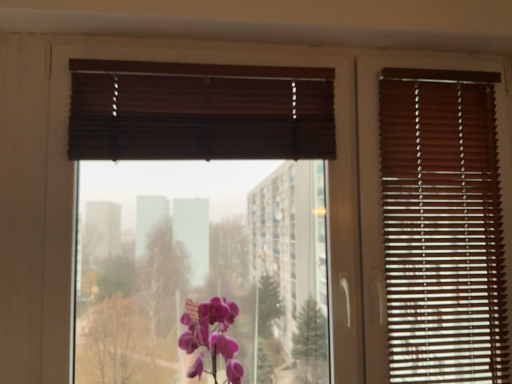
Question: Based on their positions, is brown wood blinds at center located to the left or right of purple glossy orchid at center?

Choices:
 (A) right
 (B) left

Answer: (B)

Question: In the image, is brown wood blinds at center positioned in front of or behind purple glossy orchid at center?

Choices:
 (A) behind
 (B) front

Answer: (A)

Question: Is point (209, 137) positioned closer to the camera than point (226, 339)?

Choices:
 (A) farther
 (B) closer

Answer: (A)

Question: Based on their positions, is purple glossy orchid at center located to the left or right of brown wood blinds at center?

Choices:
 (A) right
 (B) left

Answer: (A)

Question: Does point (186, 337) appear closer or farther from the camera than point (295, 112)?

Choices:
 (A) farther
 (B) closer

Answer: (B)

Question: Relative to brown wood blinds at center, is purple glossy orchid at center in front or behind?

Choices:
 (A) front
 (B) behind

Answer: (A)

Question: Considering the positions of purple glossy orchid at center and brown wood blinds at center in the image, is purple glossy orchid at center taller or shorter than brown wood blinds at center?

Choices:
 (A) short
 (B) tall

Answer: (A)